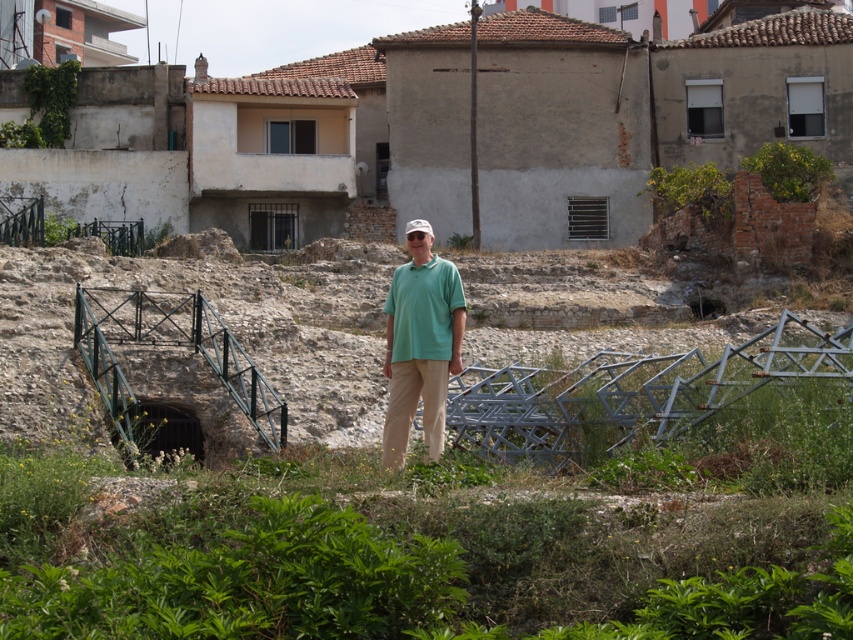
You are an archaeologist examining the scene. You notice two green items at the center of the image. Which one is closer to you, the green matte shirt at center or the green matte polo shirt at center?

The green matte shirt at center is closer to you because it is in front of the green matte polo shirt at center.